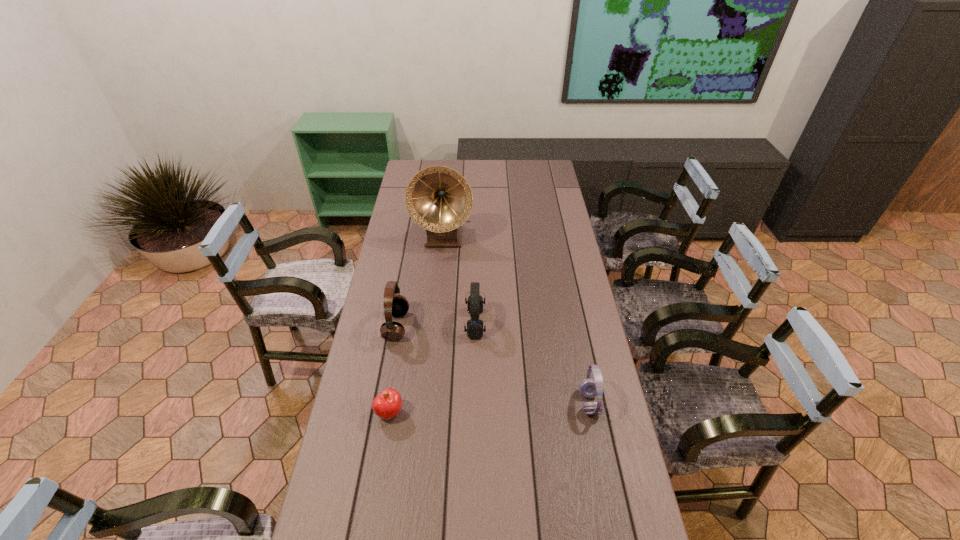
Where is `vacant point located between the shortest object and the leftmost headset`? This screenshot has width=960, height=540. vacant point located between the shortest object and the leftmost headset is located at coordinates (393, 369).

At what (x,y) coordinates should I click in order to perform the action: click on vacant space in between the leftmost headset and the apple. Please return your answer as a coordinate pair (x, y). This screenshot has height=540, width=960. Looking at the image, I should click on (393, 369).

The image size is (960, 540). I want to click on the second closest object relative to the second headset from left to right, so click(x=387, y=404).

Locate an element on the screen. The height and width of the screenshot is (540, 960). object identified as the third closest to the leftmost headset is located at coordinates (439, 199).

Identify the location of the closest headset to the second shortest object. The width and height of the screenshot is (960, 540). (475, 301).

Locate an element on the screen. The width and height of the screenshot is (960, 540). headset object that ranks as the second closest to the shortest headset is located at coordinates (397, 305).

Locate an element on the screen. The width and height of the screenshot is (960, 540). vacant area in the image that satisfies the following two spatial constraints: 1. on the back side of the shortest object; 2. on the ear pads of the leftmost headset is located at coordinates (404, 326).

Identify the location of vacant space that satisfies the following two spatial constraints: 1. on the ear pads of the apple; 2. on the right side of the leftmost headset. (381, 413).

The height and width of the screenshot is (540, 960). I want to click on free point that satisfies the following two spatial constraints: 1. on the back side of the shortest object; 2. on the ear pads of the leftmost headset, so click(x=404, y=326).